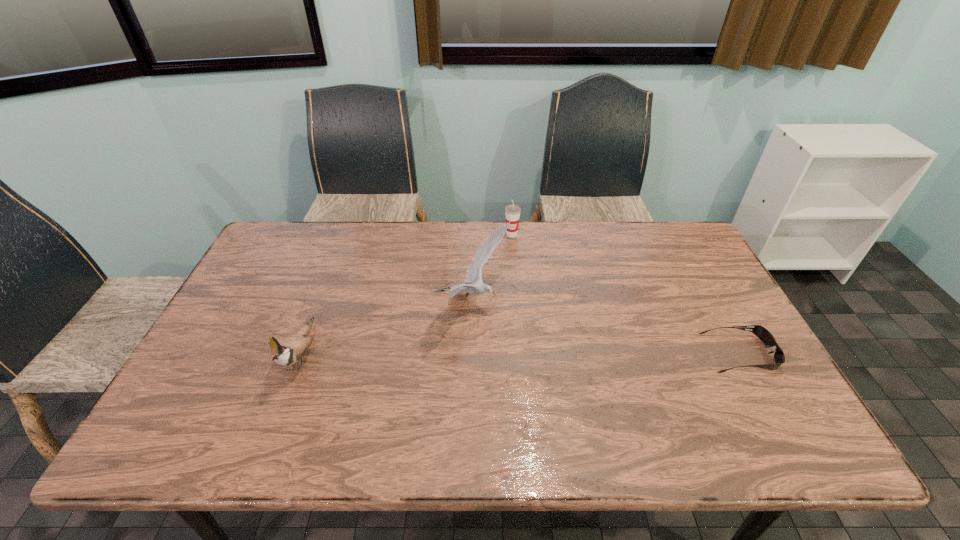
Where is `free space located 0.240m at the tip of the beak of the gull`? The width and height of the screenshot is (960, 540). free space located 0.240m at the tip of the beak of the gull is located at coordinates (587, 364).

Locate an element on the screen. vacant space situated at the tip of the beak of the gull is located at coordinates (641, 389).

Identify the location of object present at the far edge. This screenshot has height=540, width=960. (512, 212).

Where is `object situated at the near edge`? object situated at the near edge is located at coordinates (288, 350).

Identify the location of object located in the right edge section of the desktop. The image size is (960, 540). (763, 334).

This screenshot has height=540, width=960. Find the location of `vacant point at the far edge`. vacant point at the far edge is located at coordinates pyautogui.click(x=436, y=239).

At what (x,y) coordinates should I click in order to perform the action: click on vacant region at the near edge of the desktop. Please return your answer as a coordinate pair (x, y). This screenshot has width=960, height=540. Looking at the image, I should click on (461, 397).

Find the location of a particular element. vacant space at the left edge of the desktop is located at coordinates (249, 361).

Locate an element on the screen. This screenshot has width=960, height=540. free space at the far left corner is located at coordinates (283, 257).

This screenshot has height=540, width=960. Identify the location of free space at the near left corner of the desktop. (232, 407).